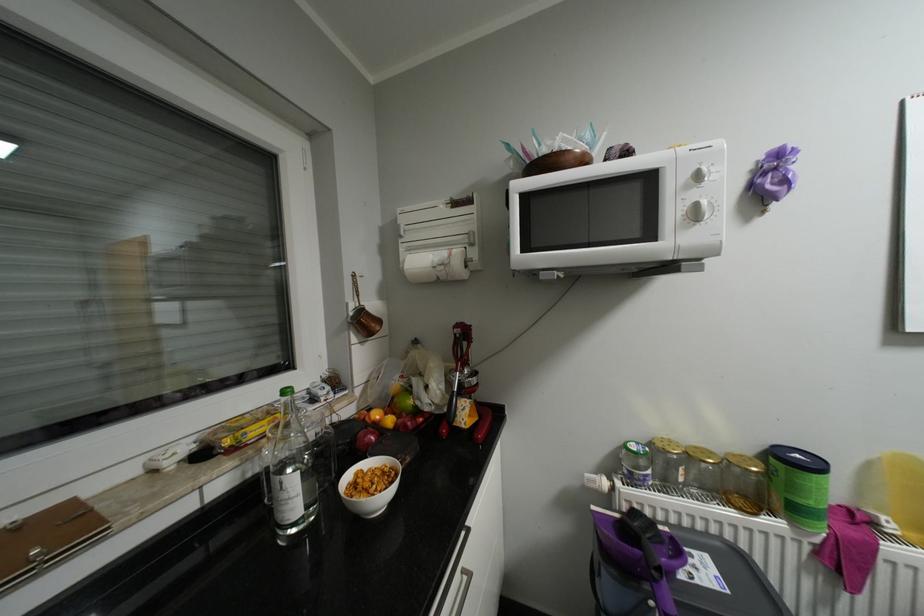
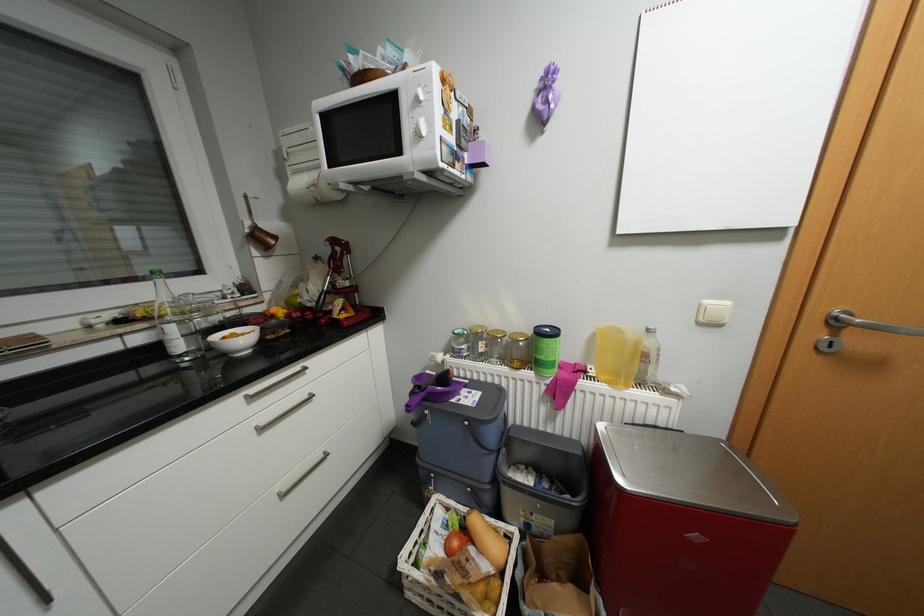
In the second image, find the point that corresponds to (800,524) in the first image.

(544, 373)